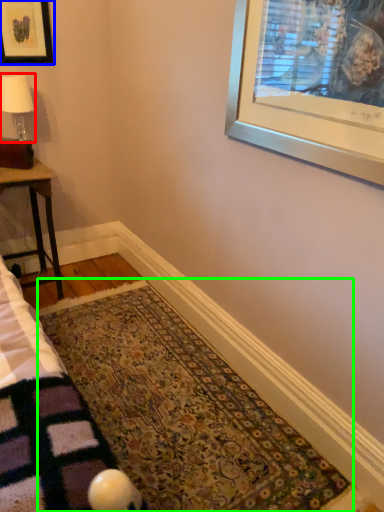
Question: Which object is positioned closest to lamp (highlighted by a red box)? Select from picture frame (highlighted by a blue box) and mat (highlighted by a green box).

Choices:
 (A) picture frame
 (B) mat

Answer: (A)